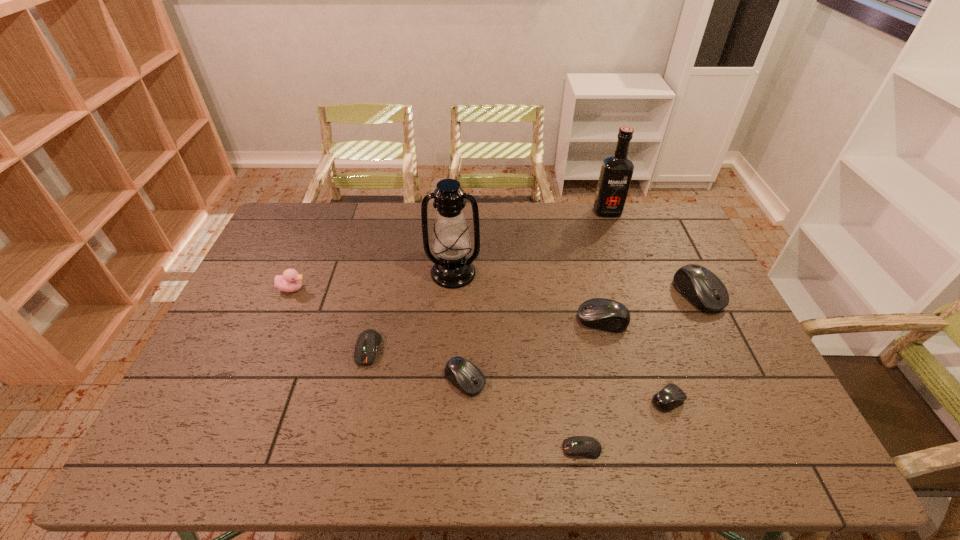
You are a GUI agent. You are given a task and a screenshot of the screen. Output one action in this format:
    pyautogui.click(x=<x>, y=<y>)
    Task: Click on the vacant space situated 0.220m on the right of the second biggest black mouse
    The height and width of the screenshot is (540, 960).
    Given the screenshot: What is the action you would take?
    pyautogui.click(x=702, y=320)

Where is `free spot located 0.120m on the front of the fourth shortest computer equipment`? This screenshot has width=960, height=540. free spot located 0.120m on the front of the fourth shortest computer equipment is located at coordinates (463, 443).

This screenshot has width=960, height=540. Identify the location of free space located 0.260m on the button of the leftmost computer equipment. (343, 463).

In order to click on free spot located 0.140m on the right of the smallest black mouse in this screenshot , I will do `click(740, 400)`.

Where is `vacant space situated on the button of the fourth computer equipment from right to left`? This screenshot has width=960, height=540. vacant space situated on the button of the fourth computer equipment from right to left is located at coordinates (399, 449).

Find the location of a particular element. The image size is (960, 540). free space located 0.310m on the button of the fourth computer equipment from right to left is located at coordinates (429, 449).

Identify the location of vacant region located 0.400m on the button of the fourth computer equipment from right to left. The image size is (960, 540). (391, 449).

You are a GUI agent. You are given a task and a screenshot of the screen. Output one action in this format:
    pyautogui.click(x=<x>, y=<y>)
    Task: Click on the object located at the far edge
    The width and height of the screenshot is (960, 540).
    Given the screenshot: What is the action you would take?
    pyautogui.click(x=616, y=172)

Find the location of `object that is at the near edge`. object that is at the near edge is located at coordinates point(585,446).

Find the location of a particular element. The image size is (960, 540). object that is positioned at the left edge is located at coordinates (290, 281).